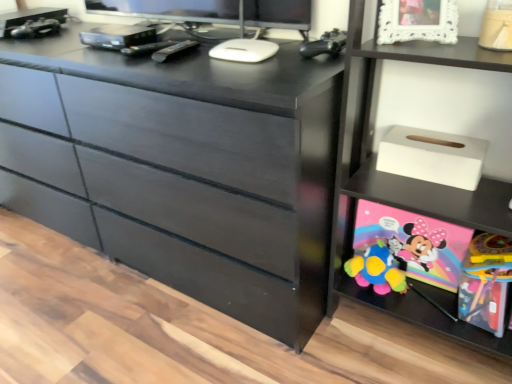
Question: From the image's perspective, relative to rubberized plastic toy at lower right, the first toy from the bottom, is white lace picture frame at upper right above or below?

Choices:
 (A) below
 (B) above

Answer: (B)

Question: In terms of height, does white lace picture frame at upper right look taller or shorter compared to rubberized plastic toy at lower right, the first toy from the bottom?

Choices:
 (A) tall
 (B) short

Answer: (B)

Question: Considering the real-world distances, which object is closest to the white lace picture frame at upper right?

Choices:
 (A) rubberized plastic toy at lower right, the 2th toy in the top-to-bottom sequence
 (B) black plastic remote at center
 (C) black matte controller at upper right, the first toy viewed from the left
 (D) matte black dresser at center
 (E) white matte tissue box at upper right

Answer: (C)

Question: Which is farther from the white matte tissue box at right?

Choices:
 (A) white matte tissue box at upper right
 (B) rubberized plastic toy at lower right, the first toy positioned from the right
 (C) black matte controller at upper right, the first toy viewed from the left
 (D) white lace picture frame at upper right
 (E) black plastic remote at center

Answer: (E)